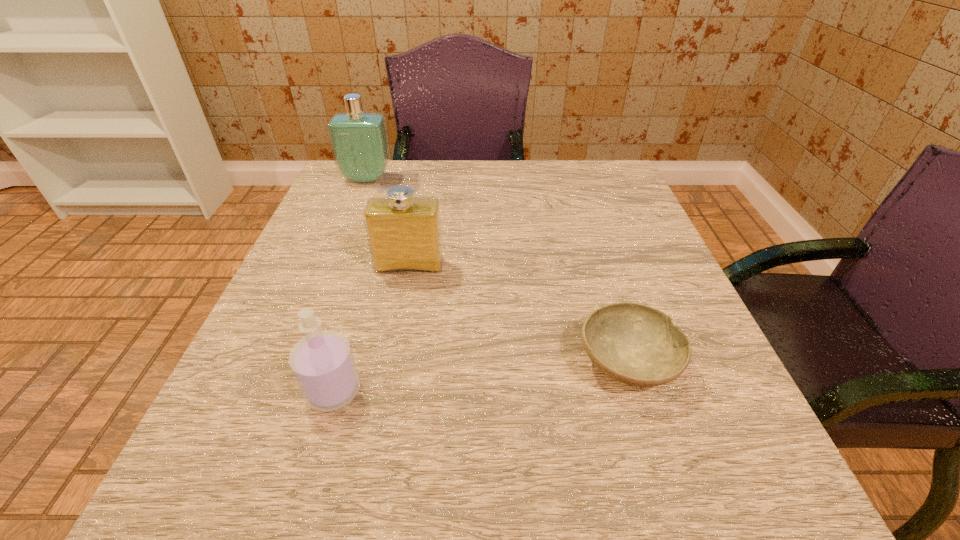
Image resolution: width=960 pixels, height=540 pixels. In order to click on free spot between the second farthest object and the shortest perfume in this screenshot , I will do `click(372, 328)`.

This screenshot has width=960, height=540. I want to click on empty location between the nearest perfume and the rightmost object, so click(480, 376).

Where is `free space between the nearest perfume and the farthest perfume`? This screenshot has width=960, height=540. free space between the nearest perfume and the farthest perfume is located at coordinates (350, 285).

What are the coordinates of `blank region between the second nearest perfume and the rightmost object` in the screenshot? It's located at (518, 314).

Where is `vacant area that lies between the bowl and the farthest perfume`? vacant area that lies between the bowl and the farthest perfume is located at coordinates pyautogui.click(x=497, y=271).

The width and height of the screenshot is (960, 540). What are the coordinates of `vacant point located between the shortest perfume and the rightmost object` in the screenshot? It's located at (480, 376).

What are the coordinates of `free space between the farthest perfume and the shortest perfume` in the screenshot? It's located at (350, 285).

The height and width of the screenshot is (540, 960). In order to click on object that ranks as the third closest to the third tallest object in this screenshot , I will do `click(359, 141)`.

At what (x,y) coordinates should I click in order to perform the action: click on object that is the second closest to the rightmost object. Please return your answer as a coordinate pair (x, y). This screenshot has width=960, height=540. Looking at the image, I should click on coord(322,362).

Identify which perfume is the second nearest to the rightmost object. Please provide its 2D coordinates. Your answer should be formatted as a tuple, i.e. [(x, y)], where the tuple contains the x and y coordinates of a point satisfying the conditions above.

[(322, 362)]